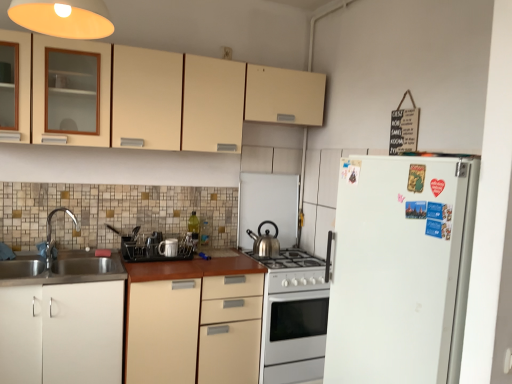
Question: From the image's perspective, relative to matte black dish rack at center, positioned as the 4th appliance in right-to-left order, is brushed metal faucet at left above or below?

Choices:
 (A) below
 (B) above

Answer: (B)

Question: Does point (74, 221) appear closer or farther from the camera than point (148, 238)?

Choices:
 (A) closer
 (B) farther

Answer: (A)

Question: Which is nearer to the white glossy oven at center?

Choices:
 (A) beige matte cabinet at center, the 1th cabinetry positioned from the bottom
 (B) white matte refrigerator at right
 (C) satin silver kettle at center, arranged as the 1th appliance when viewed from the right
 (D) white glossy gas stove at center
 (E) black plastic dish rack at center, which is the 3th appliance in right-to-left order

Answer: (D)

Question: Based on their relative distances, which object is nearer to the black plastic dish rack at center, which is the 3th appliance in right-to-left order?

Choices:
 (A) white matte cabinet at lower left, arranged as the second cabinetry when viewed from the top
 (B) matte cream cabinets at upper center, the 1th cabinetry in the top-to-bottom sequence
 (C) beige matte cabinet at center, the 1th cabinetry positioned from the bottom
 (D) white ceramic mug at center, the third appliance positioned from the left
 (E) polished stainless steel kettle at center

Answer: (D)